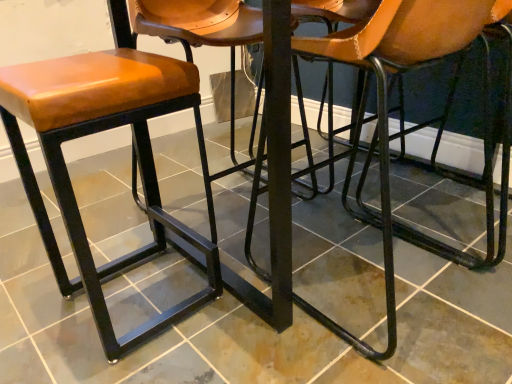
Question: From the image's perspective, is matte black stool at center positioned above or below brown leather chair at center?

Choices:
 (A) above
 (B) below

Answer: (B)

Question: Considering their positions, is matte black stool at center located in front of or behind brown leather chair at center?

Choices:
 (A) front
 (B) behind

Answer: (A)

Question: Estimate the real-world distances between objects in this image. Which object is closer to the matte black stool at center?

Choices:
 (A) brown leather chair at center
 (B) matte brown leather stool at left

Answer: (B)

Question: Estimate the real-world distances between objects in this image. Which object is farther from the brown leather chair at center?

Choices:
 (A) matte black stool at center
 (B) matte brown leather stool at left

Answer: (B)